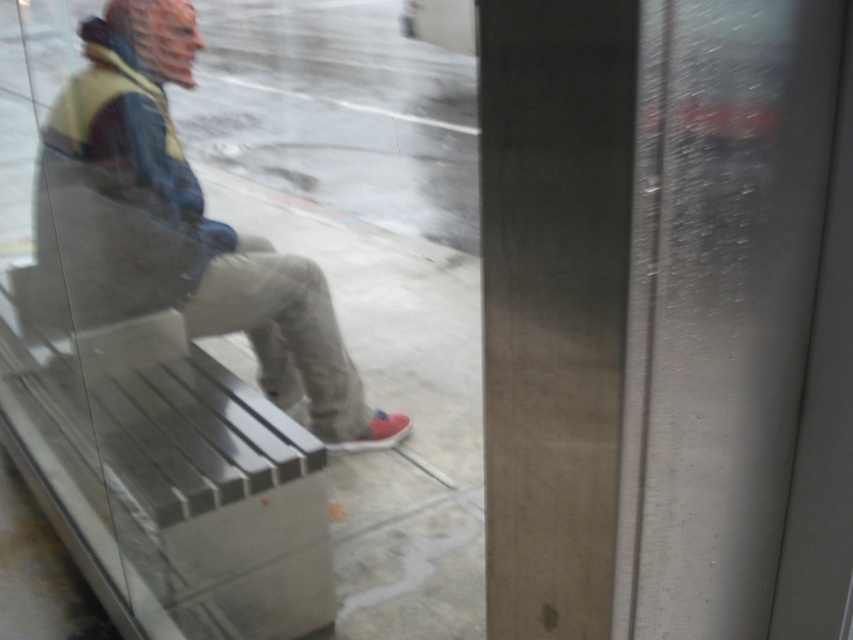
Question: Considering the relative positions of matte black jacket at center and red suede shoe at lower center in the image provided, where is matte black jacket at center located with respect to red suede shoe at lower center?

Choices:
 (A) left
 (B) right

Answer: (A)

Question: Which object is closer to the camera taking this photo?

Choices:
 (A) red suede shoe at lower center
 (B) matte black jacket at center

Answer: (B)

Question: Which of the following is the closest to the observer?

Choices:
 (A) red suede shoe at lower center
 (B) matte black jacket at center

Answer: (B)

Question: Among these points, which one is nearest to the camera?

Choices:
 (A) (276, 346)
 (B) (376, 419)

Answer: (A)

Question: Is matte black jacket at center wider than red suede shoe at lower center?

Choices:
 (A) no
 (B) yes

Answer: (B)

Question: Is matte black jacket at center positioned before red suede shoe at lower center?

Choices:
 (A) no
 (B) yes

Answer: (B)